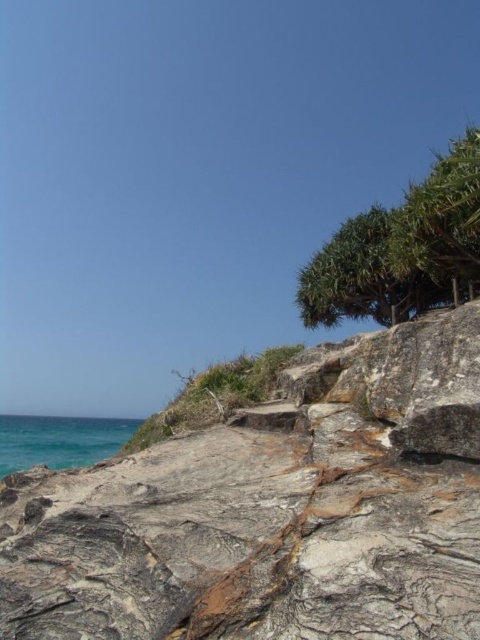
You are standing at the base of the stone steps carved into the rock face. You want to walk towards the green leafy tree at upper right and then to the teal water at lower left. Which direction should you go first to reach the tree before the water?

You should first go towards the green leafy tree at upper right before heading to the teal water at lower left since the tree is located at the upper right, which is the direction you need to face when moving up the stone steps leading upwards towards the right side of the frame.

You are a hiker trying to navigate this coastal area. You need to decide whether to climb the gray rough rock at lower left or walk around the green leafy tree at upper right. Which option requires more physical effort due to the size of the objects?

The gray rough rock at lower left has a larger size compared to the green leafy tree at upper right, so climbing the gray rough rock at lower left would require more physical effort due to its size.

You are standing at the base of the rocky terrain in the coastal scene. You see two points marked in the image. Which point, point (443, 250) or point (84, 460), is closer to you?

Point (443, 250) is closer to the camera than point (84, 460), so it is closer to you.